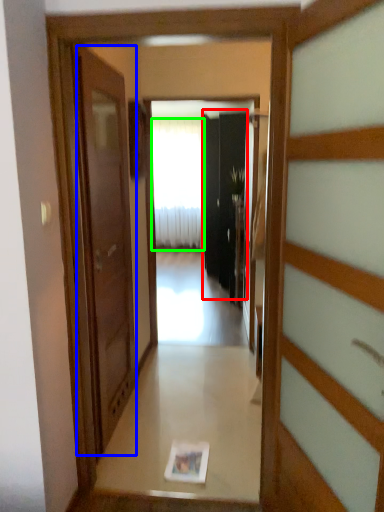
Question: Based on their relative distances, which object is nearer to screen door (highlighted by a red box)? Choose from door (highlighted by a blue box) and curtain (highlighted by a green box).

Choices:
 (A) door
 (B) curtain

Answer: (B)